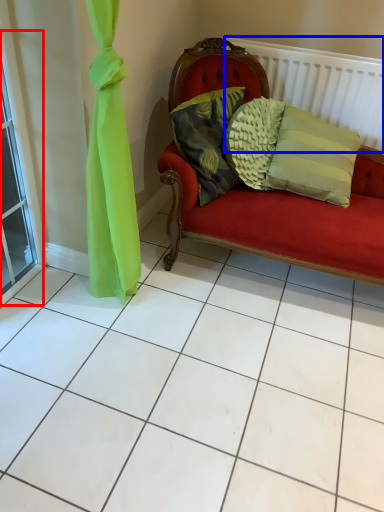
Question: Among these objects, which one is farthest to the camera, window (highlighted by a red box) or balustrade (highlighted by a blue box)?

Choices:
 (A) window
 (B) balustrade

Answer: (B)